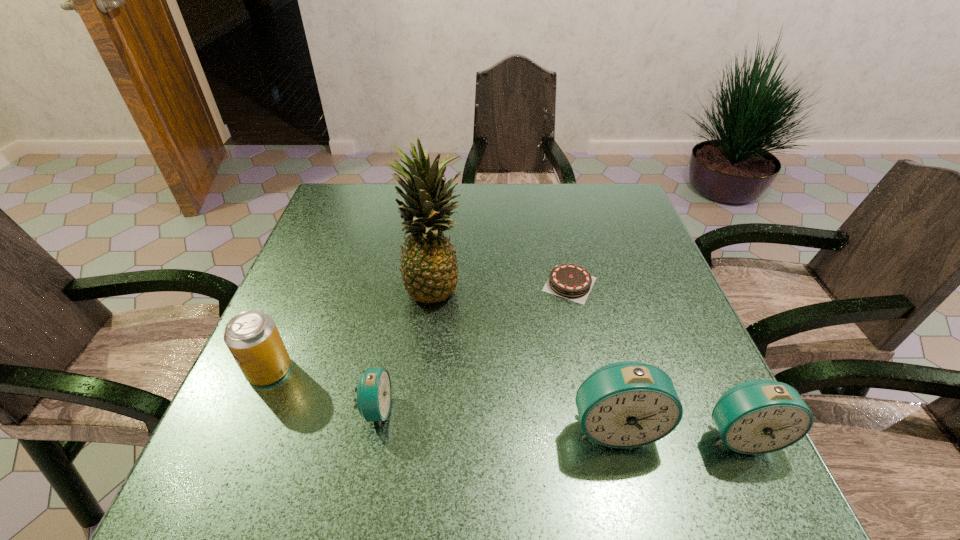
Where is `vacant point located between the leftmost object and the second alarm clock from left to right`? vacant point located between the leftmost object and the second alarm clock from left to right is located at coordinates (443, 398).

Where is `vacant space that is in between the leftmost object and the second alarm clock from left to right`? The height and width of the screenshot is (540, 960). vacant space that is in between the leftmost object and the second alarm clock from left to right is located at coordinates pos(443,398).

You are a GUI agent. You are given a task and a screenshot of the screen. Output one action in this format:
    pyautogui.click(x=<x>, y=<y>)
    Task: Click on the free point between the leftmost alarm clock and the second tallest alarm clock
    
    Given the screenshot: What is the action you would take?
    pyautogui.click(x=559, y=422)

The width and height of the screenshot is (960, 540). Find the location of `vacant space that is in between the second alarm clock from right to left and the rightmost alarm clock`. vacant space that is in between the second alarm clock from right to left and the rightmost alarm clock is located at coordinates (678, 430).

Locate an element on the screen. This screenshot has width=960, height=540. vacant area between the tallest object and the pop (soda) is located at coordinates (351, 328).

Image resolution: width=960 pixels, height=540 pixels. I want to click on vacant space that's between the chocolate cake and the leftmost object, so click(420, 327).

This screenshot has width=960, height=540. I want to click on free space between the chocolate cake and the tallest object, so click(502, 286).

You are a GUI agent. You are given a task and a screenshot of the screen. Output one action in this format:
    pyautogui.click(x=<x>, y=<y>)
    Task: Click on the vacant space that's between the fifth tallest object and the second alarm clock from left to right
    
    Given the screenshot: What is the action you would take?
    pyautogui.click(x=495, y=417)

Identify the location of empty space between the tallest object and the shortest alarm clock. (405, 348).

Locate an element on the screen. Image resolution: width=960 pixels, height=540 pixels. the third closest object to the tallest object is located at coordinates 252,337.